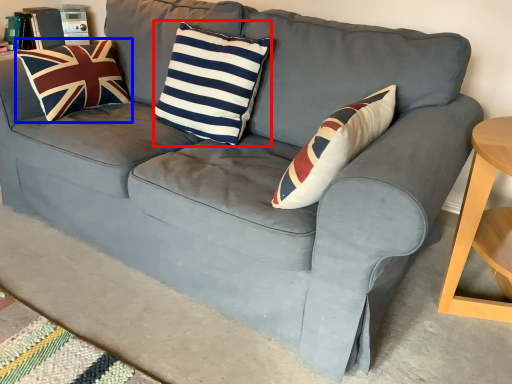
Question: Which object appears farthest to the camera in this image, pillow (highlighted by a red box) or pillow (highlighted by a blue box)?

Choices:
 (A) pillow
 (B) pillow

Answer: (B)